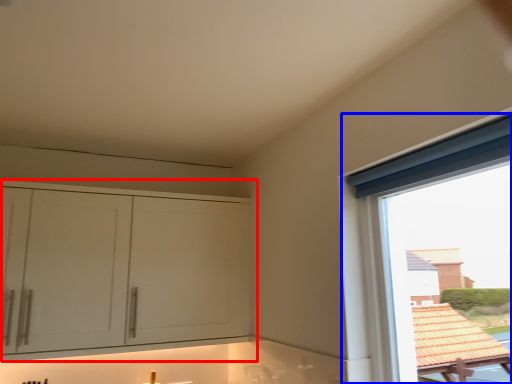
Question: Which object appears farthest to the camera in this image, cabinetry (highlighted by a red box) or window (highlighted by a blue box)?

Choices:
 (A) cabinetry
 (B) window

Answer: (A)